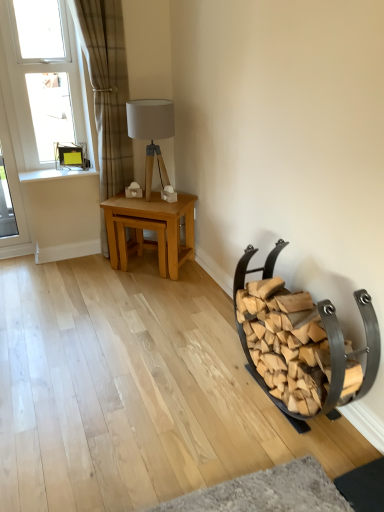
Where is `space that is in front of plaid fabric curtain at left`? Image resolution: width=384 pixels, height=512 pixels. space that is in front of plaid fabric curtain at left is located at coordinates coord(103,270).